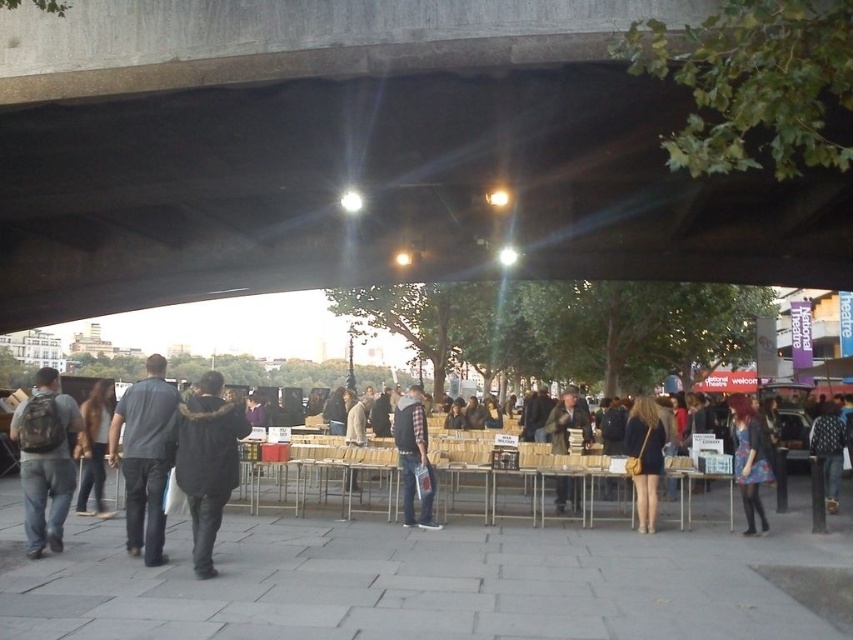
You are standing at the entrance of the bridge and want to place a new table for a book stall between the concrete at center and the brown leather jacket at center. Which object should you place the table closer to if you want it to be on the left side of the jacket?

The concrete at center is positioned on the left side of brown leather jacket at center, so placing the table closer to the concrete at center would position it on the left side of the brown leather jacket at center.

You are standing at the entrance of the bridge and want to reach the point marked by point (576, 500). There is an obstacle at point (91, 90). Can you go around it to reach your destination?

Since point (91, 90) is in front of point (576, 500), you can go around it to reach your destination.